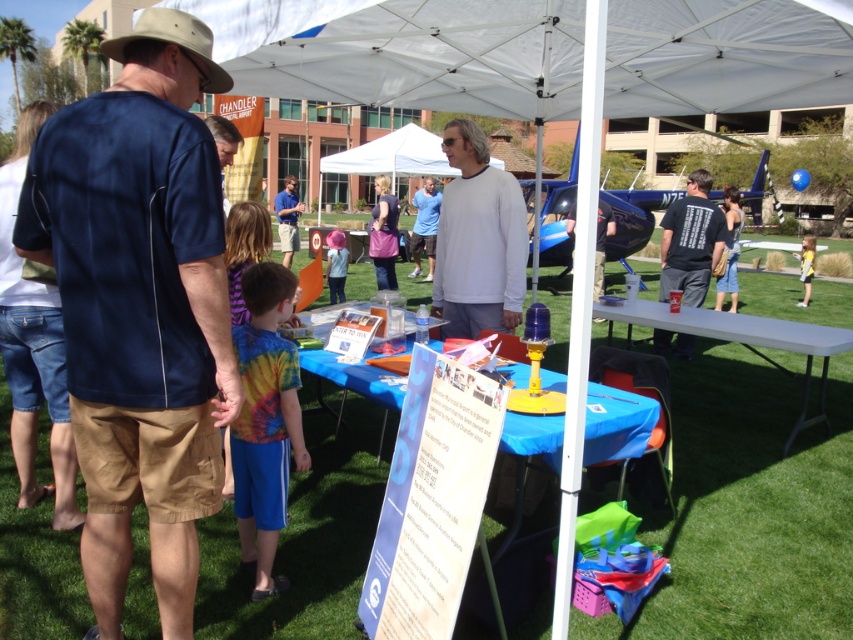
Question: Which object appears farthest from the camera in this image?

Choices:
 (A) white fabric canopy at upper center
 (B) yellow fabric shirt at right
 (C) tie-dye fabric shorts at lower center
 (D) white plastic table at right

Answer: (B)

Question: Which is farther from the white matte long-sleeve shirt at center?

Choices:
 (A) tie-dye fabric shorts at lower center
 (B) blue shirt at center

Answer: (B)

Question: Estimate the real-world distances between objects in this image. Which object is closer to the white fabric canopy at upper center?

Choices:
 (A) yellow fabric shirt at right
 (B) pink fabric umbrella at center
 (C) white plastic table at right

Answer: (C)

Question: Does dark blue shirt at left have a smaller size compared to blue fabric table at center?

Choices:
 (A) yes
 (B) no

Answer: (B)

Question: Is dark blue shirt at left wider than blue fabric table at center?

Choices:
 (A) no
 (B) yes

Answer: (B)

Question: Is blue cotton shirt at center in front of yellow fabric shirt at right?

Choices:
 (A) no
 (B) yes

Answer: (A)